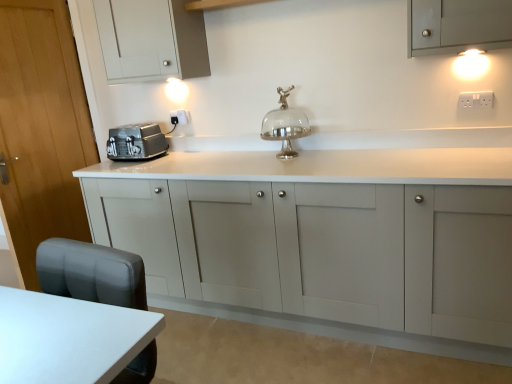
Measure the distance between white plastic electric outlet at upper center, the 2th electric outlet viewed from the front, and camera.

They are 9.09 feet apart.

Where is `silver metallic cake stand at center`? This screenshot has width=512, height=384. silver metallic cake stand at center is located at coordinates (285, 125).

This screenshot has height=384, width=512. Describe the element at coordinates (285, 125) in the screenshot. I see `silver metallic cake stand at center` at that location.

This screenshot has height=384, width=512. Describe the element at coordinates (136, 142) in the screenshot. I see `satin silver toaster at left` at that location.

Identify the location of white plastic electric outlet at upper center, which ranks as the first electric outlet in back-to-front order. (180, 117).

This screenshot has width=512, height=384. What are the coordinates of `electric outlet located in front of the white plastic electric outlet at upper center, the 2th electric outlet viewed from the front` in the screenshot? It's located at (475, 100).

How many degrees apart are the facing directions of white plastic electric outlet at upper center, placed as the second electric outlet when sorted from right to left, and white plastic electric outlet at upper right, the second electric outlet from the back?

There is a 1.96-degree angle between the facing directions of white plastic electric outlet at upper center, placed as the second electric outlet when sorted from right to left, and white plastic electric outlet at upper right, the second electric outlet from the back.

Could you measure the distance between white plastic electric outlet at upper center, which ranks as the first electric outlet in back-to-front order, and white plastic electric outlet at upper right, the 2th electric outlet in the left-to-right sequence?

The distance of white plastic electric outlet at upper center, which ranks as the first electric outlet in back-to-front order, from white plastic electric outlet at upper right, the 2th electric outlet in the left-to-right sequence, is 1.66 meters.

From the image's perspective, which one is positioned higher, white plastic electric outlet at upper center, placed as the second electric outlet when sorted from right to left, or white plastic electric outlet at upper right, the second electric outlet from the back?

white plastic electric outlet at upper center, placed as the second electric outlet when sorted from right to left, appears higher in the image.

Which of these two, white plastic electric outlet at upper right, which ranks as the first electric outlet in front-to-back order, or white glossy wall sconce at upper right, is wider?

white glossy wall sconce at upper right.

How different are the orientations of white plastic electric outlet at upper right, the 2th electric outlet in the left-to-right sequence, and white glossy wall sconce at upper right in degrees?

white plastic electric outlet at upper right, the 2th electric outlet in the left-to-right sequence, and white glossy wall sconce at upper right are facing 0.000901 degrees away from each other.

Is white plastic electric outlet at upper right, the 2th electric outlet in the left-to-right sequence, at the left side of white glossy wall sconce at upper right?

No, white plastic electric outlet at upper right, the 2th electric outlet in the left-to-right sequence, is not to the left of white glossy wall sconce at upper right.

Is white glossy table at lower left at the back of white plastic electric outlet at upper right, the second electric outlet from the back?

No, white glossy table at lower left is not at the back of white plastic electric outlet at upper right, the second electric outlet from the back.

From a real-world perspective, is white plastic electric outlet at upper right, the 2th electric outlet in the left-to-right sequence, above or below white glossy table at lower left?

white plastic electric outlet at upper right, the 2th electric outlet in the left-to-right sequence, is situated higher than white glossy table at lower left in the real world.

The width and height of the screenshot is (512, 384). I want to click on table below the white plastic electric outlet at upper right, which ranks as the first electric outlet in front-to-back order (from the image's perspective), so click(x=68, y=338).

Between matte white cabinet at upper left, arranged as the first cabinetry when viewed from the top, and wooden door at left, which one appears on the left side from the viewer's perspective?

Positioned to the left is wooden door at left.

Is wooden door at left a part of matte white cabinet at upper left, the second cabinetry from the bottom?

Actually, wooden door at left is outside matte white cabinet at upper left, the second cabinetry from the bottom.

Is point (110, 36) farther from camera compared to point (46, 14)?

No, (110, 36) is in front of (46, 14).

Is the surface of matte white cabinet at upper left, arranged as the first cabinetry when viewed from the top, in direct contact with wooden door at left?

No, matte white cabinet at upper left, arranged as the first cabinetry when viewed from the top, is not beside wooden door at left.

From a real-world perspective, is wooden door at left above or below matte gray cabinet at center, positioned as the 1th cabinetry in bottom-to-top order?

wooden door at left is above matte gray cabinet at center, positioned as the 1th cabinetry in bottom-to-top order.

Is wooden door at left not near matte gray cabinet at center, the 2th cabinetry viewed from the top?

Absolutely, wooden door at left is distant from matte gray cabinet at center, the 2th cabinetry viewed from the top.

Is matte gray cabinet at center, the 2th cabinetry viewed from the top, at the back of wooden door at left?

Yes, wooden door at left is positioned with its back facing matte gray cabinet at center, the 2th cabinetry viewed from the top.

How much distance is there between wooden door at left and matte gray cabinet at center, the 2th cabinetry viewed from the top?

A distance of 1.21 meters exists between wooden door at left and matte gray cabinet at center, the 2th cabinetry viewed from the top.

How different are the orientations of white glossy table at lower left and wooden door at left in degrees?

They differ by 80.6 degrees in their facing directions.

Is white glossy table at lower left positioned beyond the bounds of wooden door at left?

Indeed, white glossy table at lower left is completely outside wooden door at left.

Considering the positions of objects white glossy table at lower left and wooden door at left in the image provided, who is more to the left, white glossy table at lower left or wooden door at left?

From the viewer's perspective, wooden door at left appears more on the left side.

In the image, is white glossy table at lower left positioned in front of or behind wooden door at left?

white glossy table at lower left is positioned closer to the viewer than wooden door at left.

From the image's perspective, does wooden door at left appear lower than matte white cabinet at upper left, arranged as the first cabinetry when viewed from the top?

Yes, from the image's perspective, wooden door at left is beneath matte white cabinet at upper left, arranged as the first cabinetry when viewed from the top.

Which is more to the right, wooden door at left or matte white cabinet at upper left, the second cabinetry from the bottom?

matte white cabinet at upper left, the second cabinetry from the bottom.

From a real-world perspective, is wooden door at left beneath matte white cabinet at upper left, the second cabinetry from the bottom?

Yes, from a real-world perspective, wooden door at left is beneath matte white cabinet at upper left, the second cabinetry from the bottom.

Is wooden door at left situated inside matte white cabinet at upper left, the second cabinetry from the bottom, or outside?

wooden door at left is spatially situated outside matte white cabinet at upper left, the second cabinetry from the bottom.

Image resolution: width=512 pixels, height=384 pixels. Find the location of `electric outlet on the left of white plastic electric outlet at upper right, the 2th electric outlet in the left-to-right sequence`. electric outlet on the left of white plastic electric outlet at upper right, the 2th electric outlet in the left-to-right sequence is located at coordinates (180, 117).

Image resolution: width=512 pixels, height=384 pixels. What are the coordinates of `the 1st electric outlet located beneath the white glossy wall sconce at upper right (from a real-world perspective)` in the screenshot? It's located at (475, 100).

Considering their positions, is white glossy table at lower left positioned closer to satin silver toaster at left than white glossy wall sconce at upper right?

The object closer to satin silver toaster at left is white glossy table at lower left.

Considering their positions, is white glossy table at lower left positioned further to matte white cabinet at upper left, arranged as the first cabinetry when viewed from the top, than white plastic electric outlet at upper right, which is the first electric outlet from right to left?

Among the two, white glossy table at lower left is located further to matte white cabinet at upper left, arranged as the first cabinetry when viewed from the top.

Which object lies nearer to the anchor point white glossy table at lower left, white glossy wall sconce at upper right or wooden door at left?

wooden door at left is positioned closer to the anchor white glossy table at lower left.

Based on their spatial positions, is wooden door at left or silver metallic cake stand at center closer to white plastic electric outlet at upper right, the second electric outlet from the back?

silver metallic cake stand at center lies closer to white plastic electric outlet at upper right, the second electric outlet from the back, than the other object.

Looking at the image, which one is located further to matte white cabinet at upper left, arranged as the first cabinetry when viewed from the top, white plastic electric outlet at upper right, which is the first electric outlet from right to left, or satin silver toaster at left?

The object further to matte white cabinet at upper left, arranged as the first cabinetry when viewed from the top, is white plastic electric outlet at upper right, which is the first electric outlet from right to left.

Looking at the image, which one is located further to white plastic electric outlet at upper center, the 2th electric outlet viewed from the front, white plastic electric outlet at upper right, the 2th electric outlet in the left-to-right sequence, or silver metallic cake stand at center?

white plastic electric outlet at upper right, the 2th electric outlet in the left-to-right sequence, is positioned further to the anchor white plastic electric outlet at upper center, the 2th electric outlet viewed from the front.

Which object lies further to the anchor point satin silver toaster at left, white glossy table at lower left or silver metallic cake stand at center?

Among the two, white glossy table at lower left is located further to satin silver toaster at left.

From the image, which object appears to be farther from wooden door at left, white glossy wall sconce at upper right or white plastic electric outlet at upper center, which ranks as the first electric outlet in back-to-front order?

Among the two, white glossy wall sconce at upper right is located further to wooden door at left.

Identify the location of home appliance between wooden door at left and white glossy wall sconce at upper right in the horizontal direction. Image resolution: width=512 pixels, height=384 pixels. (136, 142).

Find the location of `home appliance between matte white cabinet at upper left, arranged as the first cabinetry when viewed from the top, and matte gray cabinet at center, positioned as the 1th cabinetry in bottom-to-top order, from top to bottom`. home appliance between matte white cabinet at upper left, arranged as the first cabinetry when viewed from the top, and matte gray cabinet at center, positioned as the 1th cabinetry in bottom-to-top order, from top to bottom is located at coordinates (136, 142).

Where is `door between white glossy table at lower left and satin silver toaster at left along the z-axis`? This screenshot has height=384, width=512. door between white glossy table at lower left and satin silver toaster at left along the z-axis is located at coordinates (41, 130).

This screenshot has height=384, width=512. I want to click on light fixture between satin silver toaster at left and white plastic electric outlet at upper right, which is the first electric outlet from right to left, in the horizontal direction, so click(x=471, y=63).